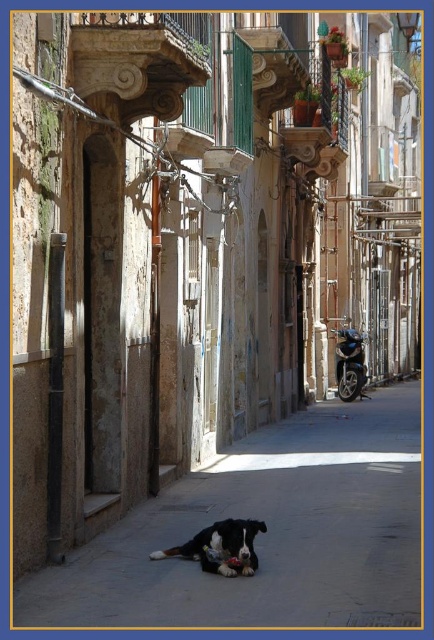
Is smooth concrete pavement at center taller than black fur dog at center?

Incorrect, smooth concrete pavement at center's height is not larger of black fur dog at center's.

Who is lower down, smooth concrete pavement at center or black fur dog at center?

smooth concrete pavement at center is below.

The image size is (434, 640). What do you see at coordinates (268, 532) in the screenshot? I see `smooth concrete pavement at center` at bounding box center [268, 532].

The height and width of the screenshot is (640, 434). Find the location of `smooth concrete pavement at center`. smooth concrete pavement at center is located at coordinates (268, 532).

Is black fur dog at center shorter than shiny blue motorcycle at center-right?

Yes, black fur dog at center is shorter than shiny blue motorcycle at center-right.

Which is in front, point (217, 545) or point (338, 369)?

Positioned in front is point (217, 545).

Find the location of a particular element. black fur dog at center is located at coordinates (220, 547).

Who is shorter, smooth concrete pavement at center or shiny blue motorcycle at center-right?

With less height is smooth concrete pavement at center.

I want to click on smooth concrete pavement at center, so click(268, 532).

Measure the distance between smooth concrete pavement at center and camera.

The distance of smooth concrete pavement at center from camera is 7.08 meters.

This screenshot has width=434, height=640. In order to click on smooth concrete pavement at center in this screenshot , I will do `click(268, 532)`.